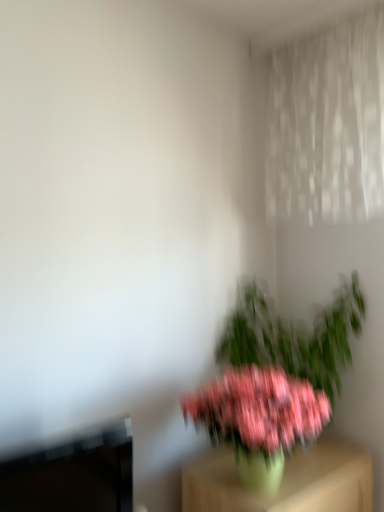
The image size is (384, 512). What do you see at coordinates (259, 408) in the screenshot?
I see `pink matte flower at center` at bounding box center [259, 408].

You are a GUI agent. You are given a task and a screenshot of the screen. Output one action in this format:
    pyautogui.click(x=<x>, y=<y>)
    Task: Click on the pink matte flower at center
    This screenshot has height=512, width=384.
    Given the screenshot: What is the action you would take?
    pyautogui.click(x=259, y=408)

Is pink matte flower at center oriented away from green matte vase at lower right?

No.

At what (x,y) coordinates should I click in order to perform the action: click on furniture below the pink matte flower at center (from a real-world perspective). Please return your answer as a coordinate pair (x, y). This screenshot has width=384, height=512. Looking at the image, I should click on (284, 481).

Does point (234, 409) come farther from viewer compared to point (335, 482)?

No, it is in front of (335, 482).

Are pink matte flower at center and green matte vase at lower right located far from each other?

No, pink matte flower at center is not far from green matte vase at lower right.

From the image's perspective, between pink matte plant at center and green matte vase at lower right, which one is located above?

pink matte plant at center.

Is pink matte plant at center situated inside green matte vase at lower right or outside?

pink matte plant at center lies outside green matte vase at lower right.

What's the angular difference between pink matte plant at center and green matte vase at lower right's facing directions?

pink matte plant at center and green matte vase at lower right are facing 0.000218 degrees away from each other.

Considering the relative sizes of pink matte plant at center and green matte vase at lower right in the image provided, is pink matte plant at center shorter than green matte vase at lower right?

In fact, pink matte plant at center may be taller than green matte vase at lower right.

Is pink matte plant at center surrounded by pink matte flower at center?

No, pink matte plant at center is not inside pink matte flower at center.

Between pink matte flower at center and pink matte plant at center, which one appears on the right side from the viewer's perspective?

pink matte plant at center is more to the right.

Is pink matte flower at center looking in the opposite direction of pink matte plant at center?

No, pink matte flower at center's orientation is not away from pink matte plant at center.

Is pink matte flower at center taller or shorter than pink matte plant at center?

In the image, pink matte flower at center appears to be shorter than pink matte plant at center.

Find the location of a particular element. The width and height of the screenshot is (384, 512). houseplant behind the pink matte flower at center is located at coordinates (274, 381).

Measure the distance from pink matte plant at center to pink matte flower at center.

A distance of 15.74 inches exists between pink matte plant at center and pink matte flower at center.

Is pink matte plant at center wider or thinner than pink matte flower at center?

Clearly, pink matte plant at center has more width compared to pink matte flower at center.

Is pink matte plant at center facing away from pink matte flower at center?

That's not correct — pink matte plant at center is not looking away from pink matte flower at center.

Is green matte vase at lower right facing away from pink matte plant at center?

No, green matte vase at lower right is not facing the opposite direction of pink matte plant at center.

Which of these two, green matte vase at lower right or pink matte plant at center, is smaller?

pink matte plant at center is smaller.

Considering the positions of objects green matte vase at lower right and pink matte plant at center in the image provided, who is more to the right, green matte vase at lower right or pink matte plant at center?

pink matte plant at center.

Is the surface of green matte vase at lower right in direct contact with pink matte plant at center?

No, green matte vase at lower right is not making contact with pink matte plant at center.

From a real-world perspective, who is located higher, green matte vase at lower right or pink matte flower at center?

pink matte flower at center, from a real-world perspective.

From the image's perspective, is green matte vase at lower right located above or below pink matte flower at center?

Based on their image positions, green matte vase at lower right is located beneath pink matte flower at center.

Which is in front, green matte vase at lower right or pink matte flower at center?

pink matte flower at center is closer to the camera.

Does point (241, 494) appear closer or farther from the camera than point (281, 410)?

Point (241, 494) is positioned farther from the camera compared to point (281, 410).

Identify the location of flower above the green matte vase at lower right (from a real-world perspective). (259, 408).

Image resolution: width=384 pixels, height=512 pixels. Find the location of `furniture located on the left of pink matte plant at center`. furniture located on the left of pink matte plant at center is located at coordinates (284, 481).

From the image, which object appears to be nearer to pink matte plant at center, pink matte flower at center or green matte vase at lower right?

green matte vase at lower right lies closer to pink matte plant at center than the other object.

Looking at the image, which one is located closer to green matte vase at lower right, pink matte flower at center or pink matte plant at center?

Based on the image, pink matte flower at center appears to be nearer to green matte vase at lower right.

In the scene shown: Estimate the real-world distances between objects in this image. Which object is further from pink matte plant at center, green matte vase at lower right or pink matte flower at center?

pink matte flower at center is further to pink matte plant at center.

Based on their spatial positions, is pink matte plant at center or green matte vase at lower right closer to pink matte flower at center?

green matte vase at lower right is positioned closer to the anchor pink matte flower at center.

Which object lies nearer to the anchor point green matte vase at lower right, pink matte plant at center or pink matte flower at center?

The object closer to green matte vase at lower right is pink matte flower at center.

From the image, which object appears to be farther from pink matte flower at center, green matte vase at lower right or pink matte plant at center?

pink matte plant at center.

Where is `flower that lies between pink matte plant at center and green matte vase at lower right from top to bottom`? The height and width of the screenshot is (512, 384). flower that lies between pink matte plant at center and green matte vase at lower right from top to bottom is located at coordinates (259, 408).